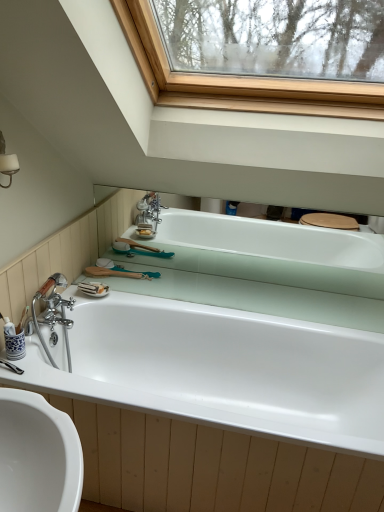
Question: Can you confirm if white glossy bathtub at center, which is the first bathtub in top-to-bottom order, is positioned to the right of white glossy bathtub at center, the first bathtub from the bottom?

Choices:
 (A) yes
 (B) no

Answer: (A)

Question: Is white glossy bathtub at center, which is the first bathtub in top-to-bottom order, taller than white glossy bathtub at center, the first bathtub from the bottom?

Choices:
 (A) yes
 (B) no

Answer: (B)

Question: Considering the relative sizes of white glossy bathtub at center, which is the first bathtub in top-to-bottom order, and white glossy bathtub at center, the first bathtub from the bottom, in the image provided, is white glossy bathtub at center, which is the first bathtub in top-to-bottom order, bigger than white glossy bathtub at center, the first bathtub from the bottom,?

Choices:
 (A) yes
 (B) no

Answer: (B)

Question: Is white glossy bathtub at center, which is the first bathtub in top-to-bottom order, next to white glossy bathtub at center, the first bathtub from the bottom?

Choices:
 (A) no
 (B) yes

Answer: (A)

Question: From a real-world perspective, does white glossy bathtub at center, which is the second bathtub in bottom-to-top order, stand above white glossy bathtub at center, the 2th bathtub in the top-to-bottom sequence?

Choices:
 (A) no
 (B) yes

Answer: (B)

Question: Is white glossy bathtub at center, the 2th bathtub in the top-to-bottom sequence, far away from white glossy bathtub at center, which is the second bathtub in bottom-to-top order?

Choices:
 (A) yes
 (B) no

Answer: (B)

Question: Does white glossy bathtub at center, the 2th bathtub in the top-to-bottom sequence, have a lesser height compared to white glossy bathtub at center, which is the second bathtub in bottom-to-top order?

Choices:
 (A) yes
 (B) no

Answer: (B)

Question: Considering the relative sizes of white glossy bathtub at center, the first bathtub from the bottom, and white glossy bathtub at center, which is the first bathtub in top-to-bottom order, in the image provided, is white glossy bathtub at center, the first bathtub from the bottom, bigger than white glossy bathtub at center, which is the first bathtub in top-to-bottom order,?

Choices:
 (A) yes
 (B) no

Answer: (A)

Question: From the image's perspective, is white glossy bathtub at center, the first bathtub from the bottom, below white glossy bathtub at center, which is the second bathtub in bottom-to-top order?

Choices:
 (A) no
 (B) yes

Answer: (B)

Question: Does white glossy bathtub at center, the first bathtub from the bottom, have a smaller size compared to white glossy bathtub at center, which is the first bathtub in top-to-bottom order?

Choices:
 (A) yes
 (B) no

Answer: (B)

Question: Considering the relative sizes of white glossy bathtub at center, the first bathtub from the bottom, and white glossy bathtub at center, which is the first bathtub in top-to-bottom order, in the image provided, is white glossy bathtub at center, the first bathtub from the bottom, taller than white glossy bathtub at center, which is the first bathtub in top-to-bottom order,?

Choices:
 (A) yes
 (B) no

Answer: (A)

Question: Is white glossy bathtub at center, the first bathtub from the bottom, in front of or behind white glossy bathtub at center, which is the second bathtub in bottom-to-top order, in the image?

Choices:
 (A) front
 (B) behind

Answer: (A)